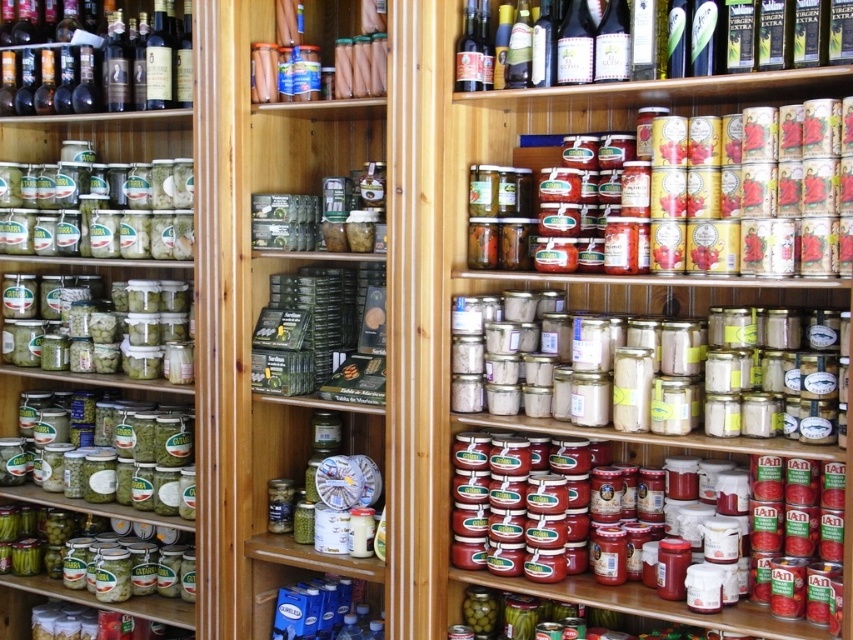
You are standing in front of the store shelf and want to reach a specific item located at point (781, 545). If your arm can extend 5 feet, can you reach the item without moving closer?

The distance between you and the point (781, 545) is 6.56 feet. Since your arm can only extend 5 feet, you cannot reach the item without moving closer.

You are a customer looking at the store shelf. You see two sets of green matte jars at left and green matte jars at center. Which set is positioned more to the left side of the shelf?

The green matte jars at left are positioned more to the left side of the shelf compared to the green matte jars at center.

You are a store employee who needs to restock the shelf. You have two green matte jars at left and green matte jars at center. If you want to place a new jar that is the same size as the smaller one, which existing jar should you use as a reference?

The green matte jars at center are smaller than the green matte jars at left. Therefore, you should use the green matte jars at center as a reference for the new jar since it is the smaller one.